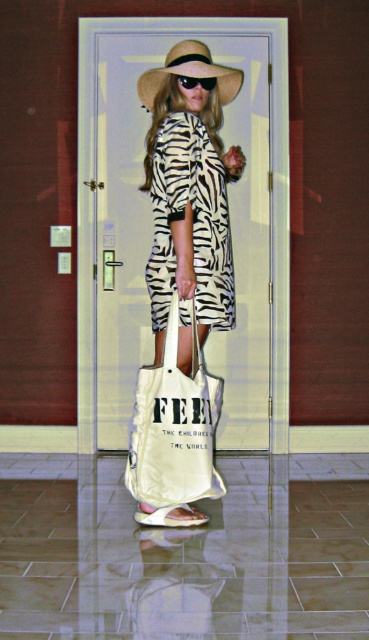
Question: Which object appears farthest from the camera in this image?

Choices:
 (A) zebra print fabric dress at center
 (B) beige fabric sandal at lower center
 (C) white canvas tote at center

Answer: (B)

Question: Can you confirm if zebra print fabric dress at center is positioned to the right of white canvas tote at center?

Choices:
 (A) no
 (B) yes

Answer: (B)

Question: Which object appears farthest from the camera in this image?

Choices:
 (A) strawmaterial/texturehat at upper center
 (B) black plastic goggles at center
 (C) zebra print fabric dress at center
 (D) white canvas tote at center

Answer: (B)

Question: Which object is positioned farthest from the strawmaterial/texturehat at upper center?

Choices:
 (A) white matte bag at center
 (B) zebra print fabric dress at center

Answer: (B)

Question: Is beige fabric sandal at lower center to the right of black plastic goggles at center from the viewer's perspective?

Choices:
 (A) no
 (B) yes

Answer: (A)

Question: Can you confirm if white matte bag at center is smaller than black plastic goggles at center?

Choices:
 (A) yes
 (B) no

Answer: (B)